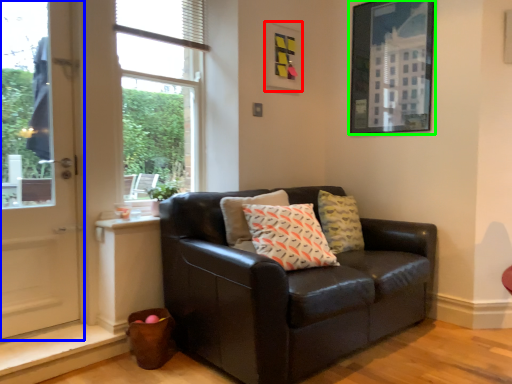
Question: Estimate the real-world distances between objects in this image. Which object is farther from picture frame (highlighted by a red box), door (highlighted by a blue box) or picture frame (highlighted by a green box)?

Choices:
 (A) door
 (B) picture frame

Answer: (A)